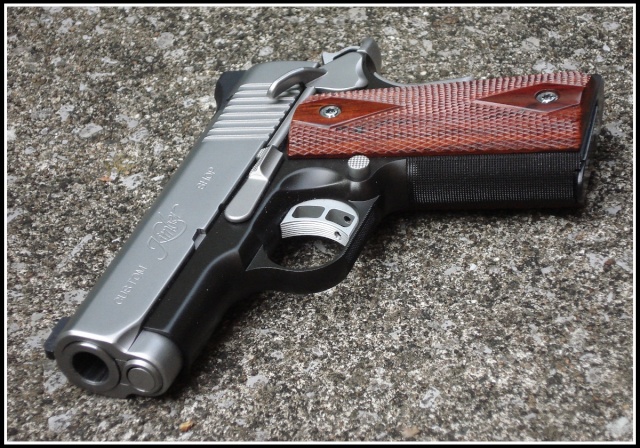
Locate an element on the screen. Image resolution: width=640 pixels, height=448 pixels. brown handle is located at coordinates (468, 106).